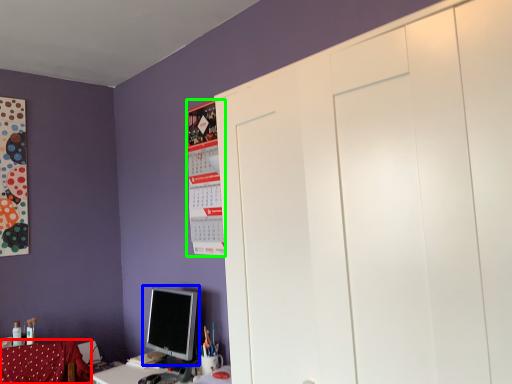
Question: Which object is positioned closest to swivel chair (highlighted by a red box)? Select from computer monitor (highlighted by a blue box) and bulletin board (highlighted by a green box).

Choices:
 (A) computer monitor
 (B) bulletin board

Answer: (A)